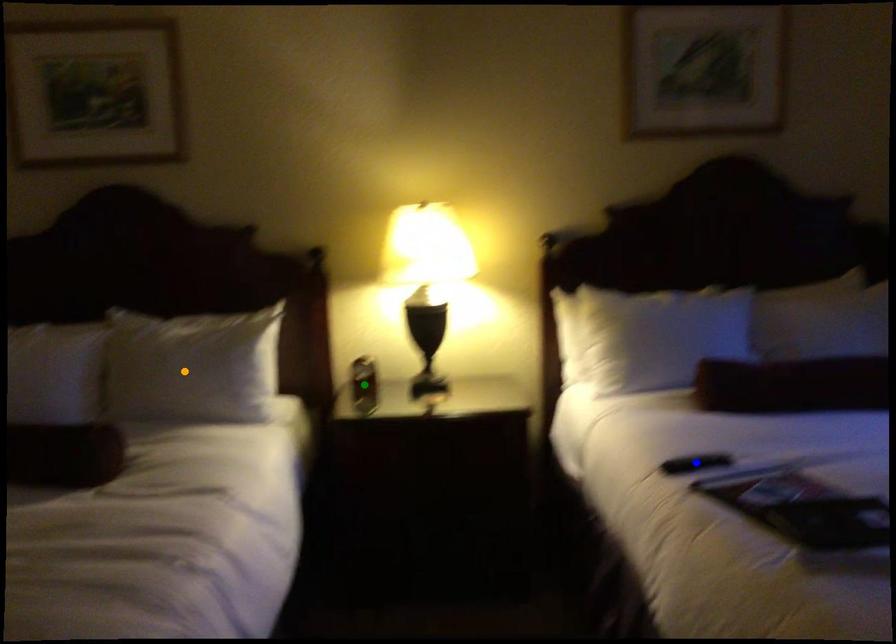
Order these from nearest to farthest:
- green point
- blue point
- orange point

blue point
orange point
green point